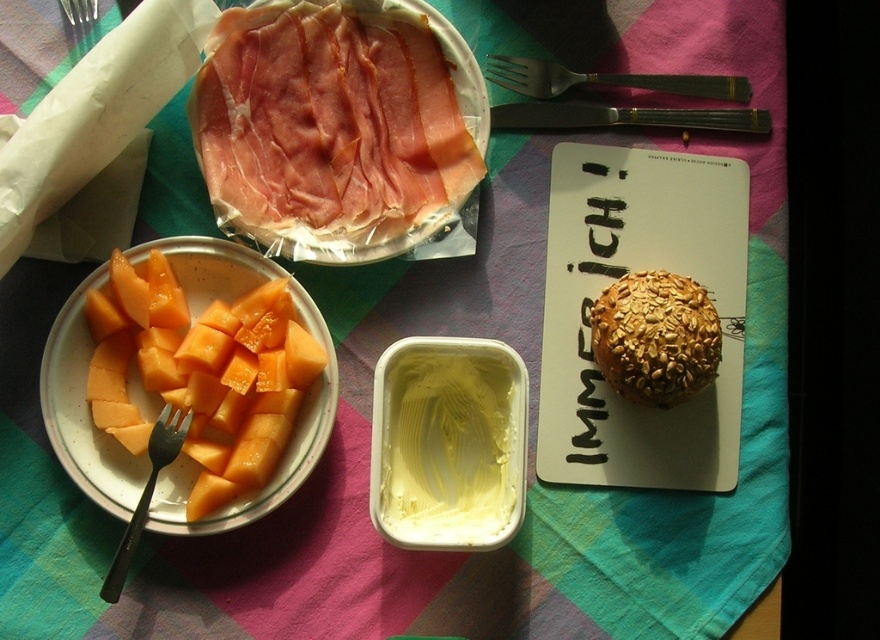
You are taking a photo of the breakfast spread and want to focus on both the point at coordinates point (673, 80) and point (70, 22). Which point should you adjust your focus to first to ensure both are in clear view?

Point (673, 80) is further to the camera than point (70, 22). To ensure both are in focus, adjust your focus starting with the closer point (70, 22) first, then the further point (673, 80).